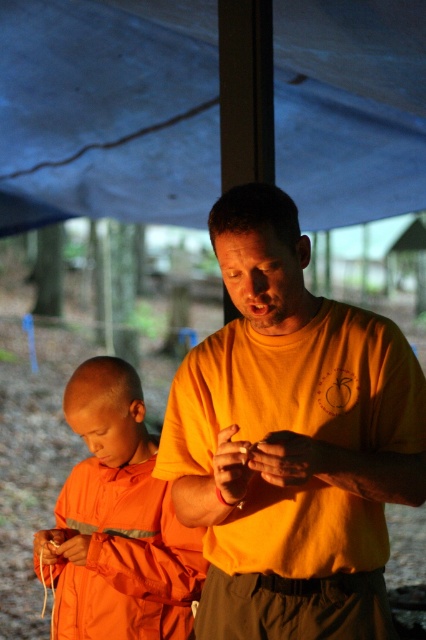
You are standing at the point with coordinates point (x=108, y=433) and want to move towards the point with coordinates point (x=55, y=616). Which direction should you move?

You should move forward because point (x=55, y=616) is behind point (x=108, y=433), meaning it is in the direction you are facing.